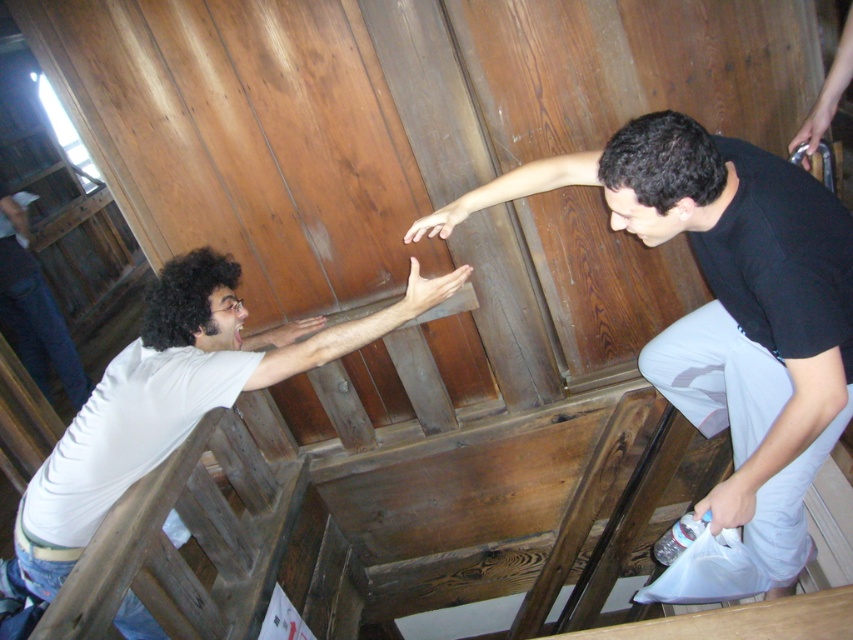
Who is more distant from viewer, [140,330] or [47,362]?

The point [47,362] is behind.

Who is positioned more to the left, white matte shirt at left or white matte shirt at lower left?

Positioned to the left is white matte shirt at lower left.

Where is `white matte shirt at left`? white matte shirt at left is located at coordinates (173, 400).

Between black matte shirt at upper right and white matte shirt at left, which one is positioned higher?

black matte shirt at upper right

Is black matte shirt at upper right below white matte shirt at left?

No.

Image resolution: width=853 pixels, height=640 pixels. What are the coordinates of `black matte shirt at upper right` in the screenshot? It's located at (729, 307).

You are a GUI agent. You are given a task and a screenshot of the screen. Output one action in this format:
    pyautogui.click(x=<x>, y=<y>)
    Task: Click on the black matte shirt at upper right
    Image resolution: width=853 pixels, height=640 pixels.
    Given the screenshot: What is the action you would take?
    pyautogui.click(x=729, y=307)

Who is positioned more to the right, black matte shirt at upper right or white matte shirt at lower left?

black matte shirt at upper right is more to the right.

Measure the distance between black matte shirt at upper right and white matte shirt at lower left.

10.59 feet

Is point (734, 188) positioned before point (15, 212)?

Yes, point (734, 188) is closer to viewer.

Locate an element on the screen. black matte shirt at upper right is located at coordinates (729, 307).